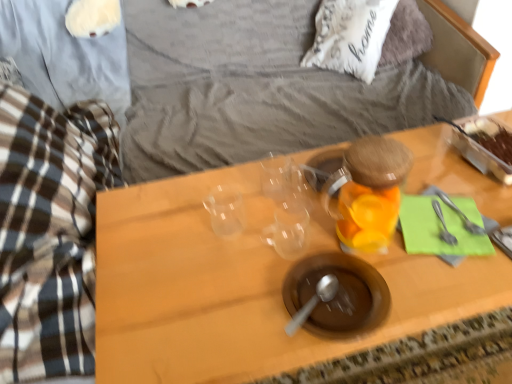
The height and width of the screenshot is (384, 512). In order to click on free location in front of silver metallic fork at right, which is the 1th silverware from right to left in this screenshot , I will do `click(464, 267)`.